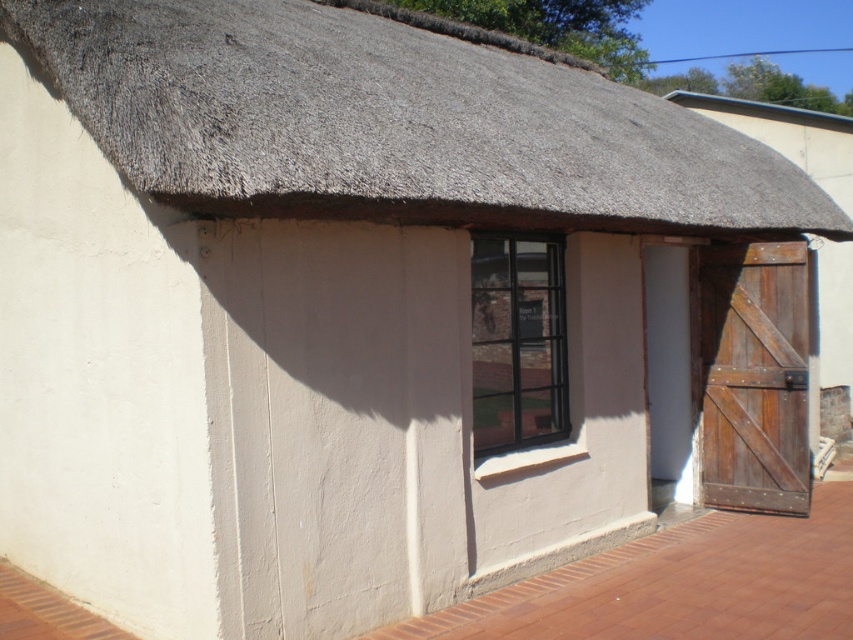
You are standing in front of the traditional building and want to place a decorative pot on the ledge below the black metal window at center. However, you notice the thatched straw roof at upper center might block sunlight from reaching the pot. Which direction should you position the pot to ensure it receives sunlight without obstruction?

The thatched straw roof at upper center is to the left of the black metal window at center. To avoid obstruction, position the pot to the right side of the ledge below the black metal window at center so it can receive sunlight without the roof blocking it.

Consider the image. You are standing in front of the traditional building and notice two points marked on the wall. The first point is at coordinates point (412,40) and the second point is at point (512,264). Which point is closer to you?

Point (412,40) is further to the camera than point (512,264), so the second point is closer to you.

You are standing outside the building and want to enter through the rustic wooden door at right. Which direction should you walk to reach the door from the thatched straw roof at upper center?

The thatched straw roof at upper center is above the rustic wooden door at right, so you should walk downward towards the rustic wooden door at right to reach it.